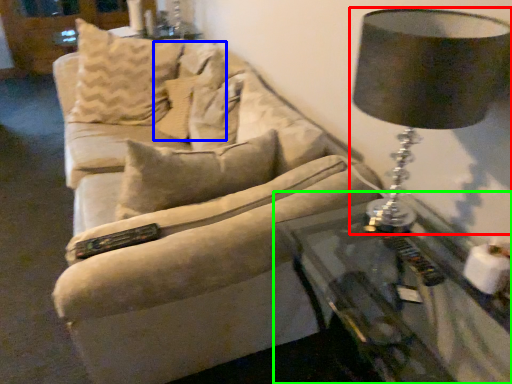
Question: Which object is positioned farthest from lamp (highlighted by a red box)? Select from pillow (highlighted by a blue box) and table (highlighted by a green box).

Choices:
 (A) pillow
 (B) table

Answer: (A)